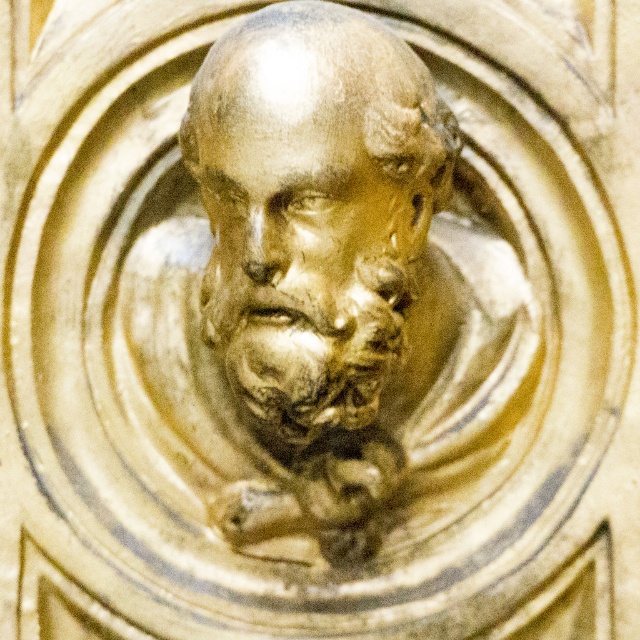
Does gold textured bust at center have a smaller size compared to golden stone face at center?

Incorrect, gold textured bust at center is not smaller in size than golden stone face at center.

Who is shorter, gold textured bust at center or golden stone face at center?

golden stone face at center

Does point (312, 353) lie behind point (288, 397)?

That is False.

This screenshot has height=640, width=640. In order to click on gold textured bust at center in this screenshot , I will do `click(321, 218)`.